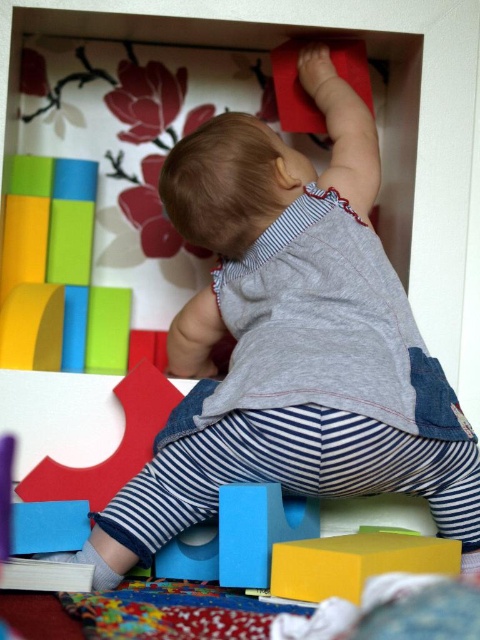
Question: Which of the following is the farthest from the observer?

Choices:
 (A) matte blue block at lower center
 (B) yellow matte block at lower center

Answer: (A)

Question: Is yellow matte block at lower center bigger than matte blue block at lower center?

Choices:
 (A) yes
 (B) no

Answer: (A)

Question: Which object appears closest to the camera in this image?

Choices:
 (A) matte blue block at lower center
 (B) yellow matte block at lower center

Answer: (B)

Question: Does yellow matte block at lower center have a smaller size compared to matte blue block at lower center?

Choices:
 (A) no
 (B) yes

Answer: (A)

Question: Does yellow matte block at lower center come behind matte blue block at lower center?

Choices:
 (A) yes
 (B) no

Answer: (B)